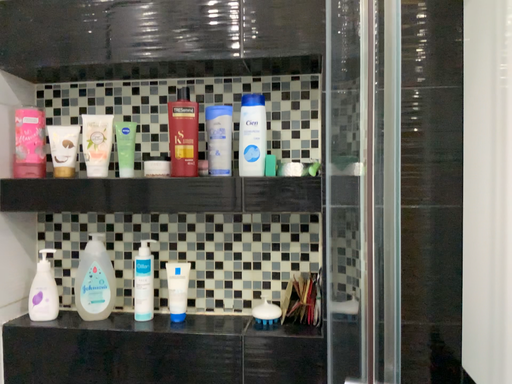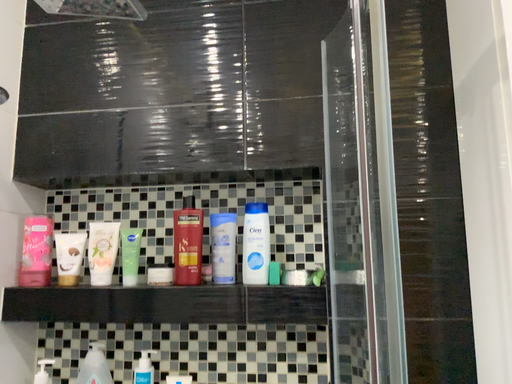
Question: How did the camera likely rotate when shooting the video?

Choices:
 (A) rotated upward
 (B) rotated downward

Answer: (A)